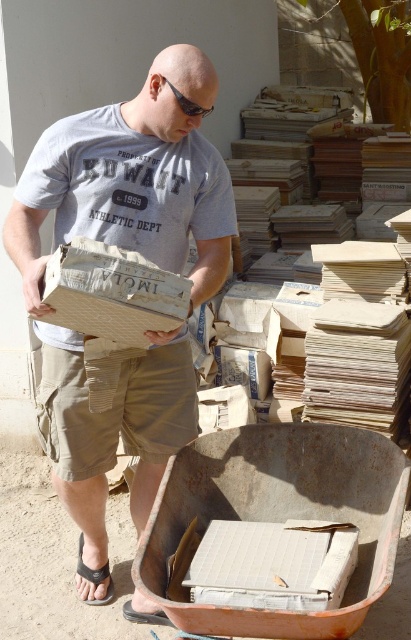
Who is lower down, matte cardboard box at center or black fabric sandal at lower left?

Positioned lower is black fabric sandal at lower left.

Is matte cardboard box at center bigger than black fabric sandal at lower left?

Yes.

Is point (92, 541) farther from camera compared to point (92, 579)?

No.

You are a GUI agent. You are given a task and a screenshot of the screen. Output one action in this format:
    pyautogui.click(x=<x>, y=<y>)
    Task: Click on the matte cardboard box at center
    
    Given the screenshot: What is the action you would take?
    pyautogui.click(x=133, y=180)

Is matte cardboard box at center wider than white corrugated cardboard box at lower center?

Correct, the width of matte cardboard box at center exceeds that of white corrugated cardboard box at lower center.

Is matte cardboard box at center above white corrugated cardboard box at lower center?

Yes.

Locate an element on the screen. The width and height of the screenshot is (411, 640). matte cardboard box at center is located at coordinates (133, 180).

Identify the location of matte cardboard box at center. (133, 180).

Which is more to the right, khaki cotton shorts at center or white corrugated cardboard box at lower center?

white corrugated cardboard box at lower center

Is khaki cotton shorts at center to the right of white corrugated cardboard box at lower center from the viewer's perspective?

No, khaki cotton shorts at center is not to the right of white corrugated cardboard box at lower center.

At what (x,y) coordinates should I click in order to perform the action: click on khaki cotton shorts at center. Please return your answer as a coordinate pair (x, y). The width and height of the screenshot is (411, 640). Looking at the image, I should click on (117, 410).

Find the location of a particular element. The height and width of the screenshot is (640, 411). khaki cotton shorts at center is located at coordinates (117, 410).